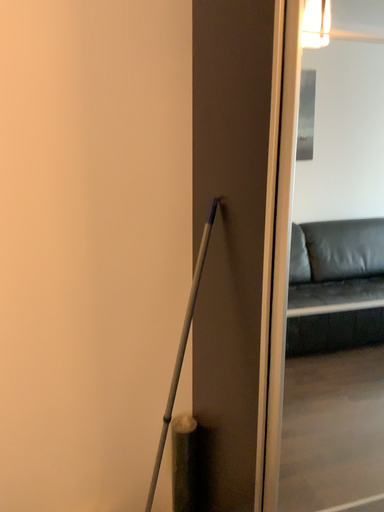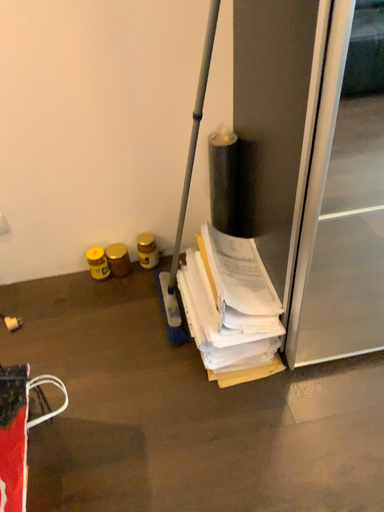
Question: Which way did the camera rotate in the video?

Choices:
 (A) rotated left
 (B) rotated right

Answer: (A)